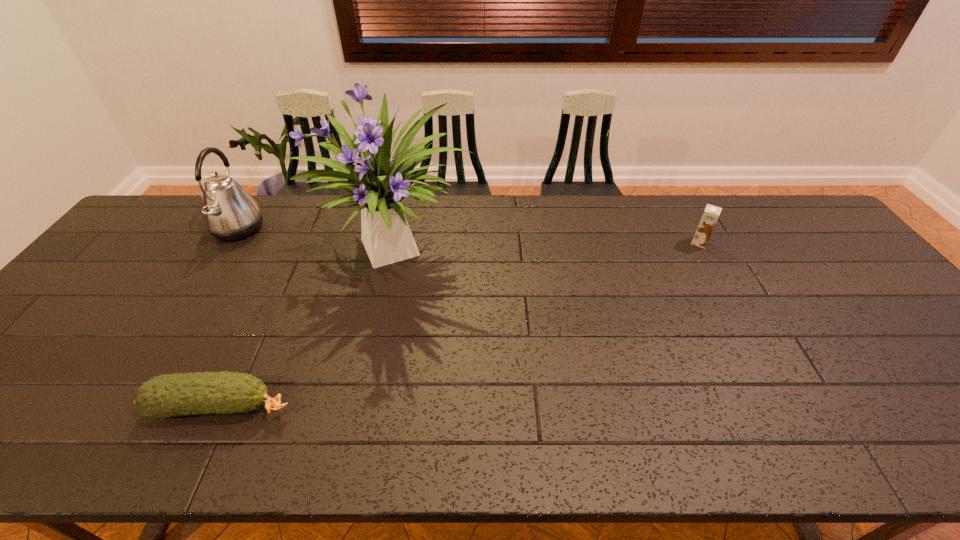
Where is `the tallest object`? The width and height of the screenshot is (960, 540). the tallest object is located at coordinates (380, 184).

At what (x,y) coordinates should I click in order to perform the action: click on kettle. Please return your answer as a coordinate pair (x, y). This screenshot has height=540, width=960. Looking at the image, I should click on (229, 212).

Where is `the second shortest object`? Image resolution: width=960 pixels, height=540 pixels. the second shortest object is located at coordinates tap(710, 216).

This screenshot has width=960, height=540. Identify the location of chocolate milk. (710, 216).

At what (x,y) coordinates should I click in order to perform the action: click on cucumber. Please return your answer as a coordinate pair (x, y). Image resolution: width=960 pixels, height=540 pixels. Looking at the image, I should click on [x=176, y=394].

Identify the location of the nearest object. (176, 394).

Locate an element on the screen. The width and height of the screenshot is (960, 540). blank space located 0.250m on the right of the flower arrangement is located at coordinates (560, 251).

Identify the location of blank area located from the spout of the second tallest object. The width and height of the screenshot is (960, 540). (296, 229).

In order to click on vacant region located on the right of the third tallest object in this screenshot , I will do `click(767, 242)`.

Where is `vacant space located 0.140m at the blossom end of the nearest object`? The image size is (960, 540). vacant space located 0.140m at the blossom end of the nearest object is located at coordinates (358, 407).